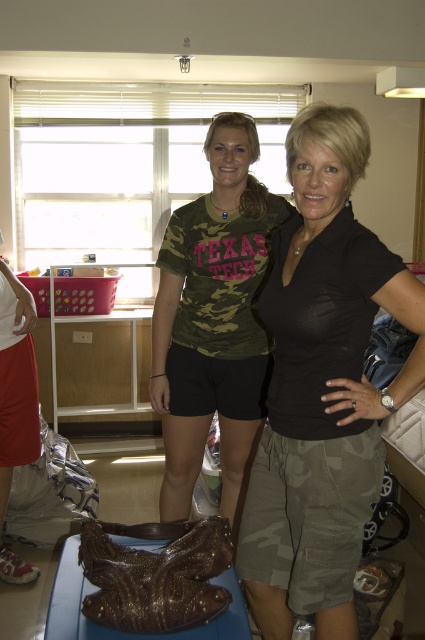
You are a photographer setting up for a shoot in this room. You need to decide where to place a new light source. Considering the matte black shirt at center and the shiny metallic shoe at lower left, which object should the light be directed towards to avoid casting a distracting reflection?

The light should be directed towards the shiny metallic shoe at lower left because the matte black shirt at center is positioned over it, so directing light towards the shoe will minimize reflections from the shiny surface while ensuring the shirt remains visible.

You are taking a photo of two friends standing in front of you. You notice the matte black shirt at center and the camo fabric shirt at center. Which one appears closer to you?

The matte black shirt at center appears closer to you because it is positioned in front of the camo fabric shirt at center.